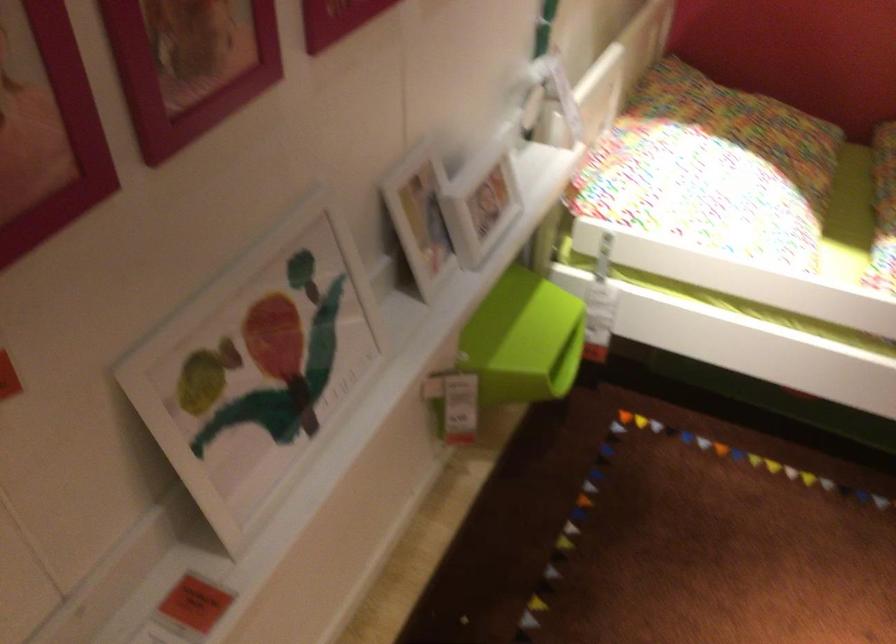
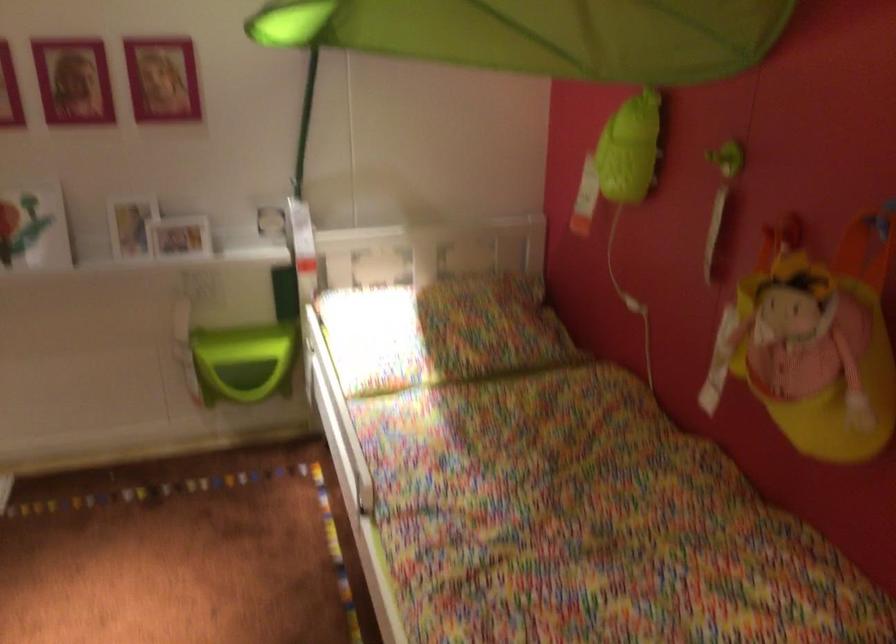
Where in the second image is the point corresponding to point 796,166 from the first image?

(440, 332)